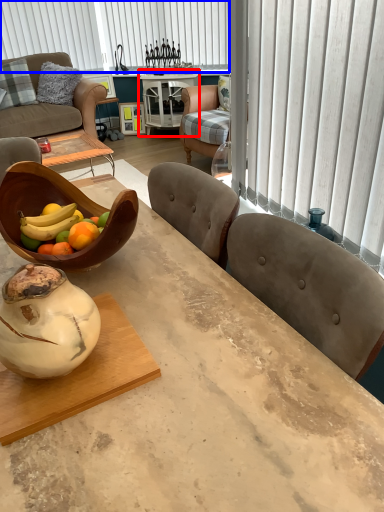
Question: Which object is closer to the camera taking this photo, round table (highlighted by a red box) or blind (highlighted by a blue box)?

Choices:
 (A) round table
 (B) blind

Answer: (A)